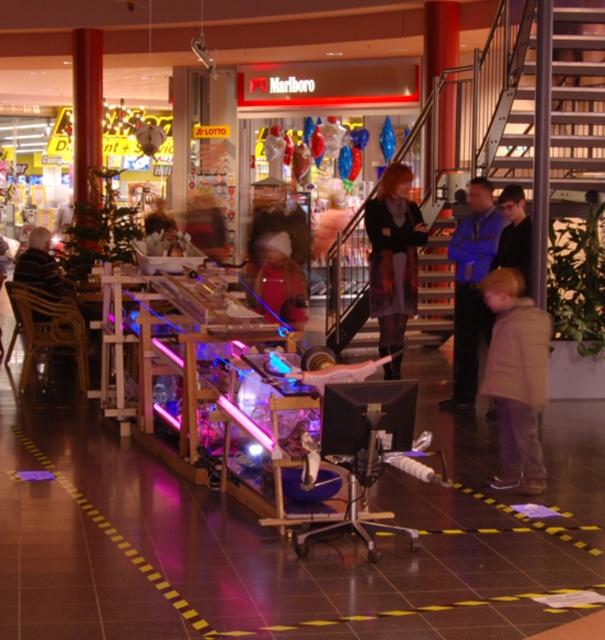
Question: Does light brown wool coat at lower right appear on the right side of striped sweater at left?

Choices:
 (A) yes
 (B) no

Answer: (A)

Question: Considering the real-world distances, which object is farthest from the light brown wool coat at lower right?

Choices:
 (A) striped sweater at left
 (B) gray wool coat at center

Answer: (A)

Question: Which of these objects is positioned closest to the gray wool coat at center?

Choices:
 (A) blue fabric jacket at center
 (B) light brown wool coat at lower right
 (C) striped sweater at left

Answer: (A)

Question: Does gray wool coat at center appear on the left side of blue fabric jacket at center?

Choices:
 (A) yes
 (B) no

Answer: (A)

Question: Can you confirm if blue fabric jacket at center is bigger than striped sweater at left?

Choices:
 (A) no
 (B) yes

Answer: (B)

Question: Which point appears farthest from the camera in this image?

Choices:
 (A) (469, 316)
 (B) (59, 276)
 (C) (509, 435)

Answer: (B)